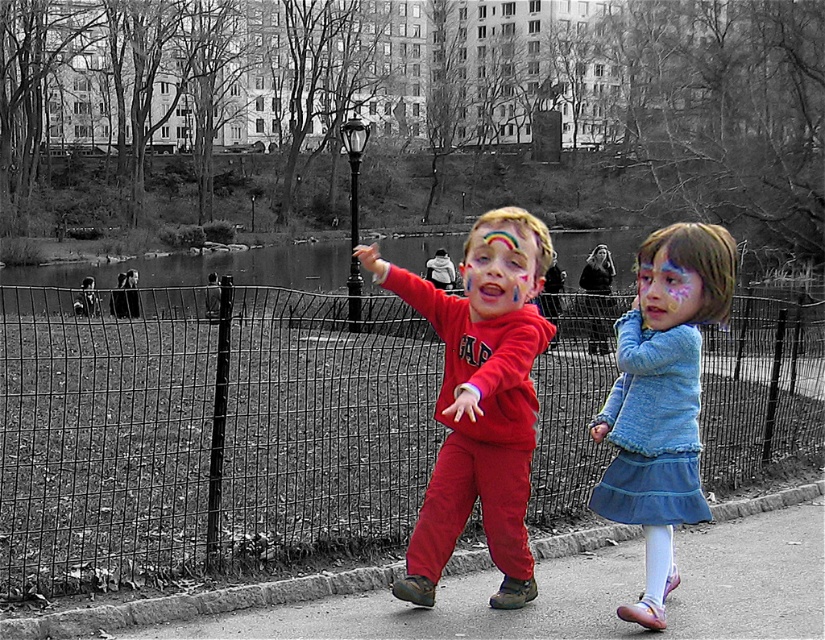
You are a drone operator trying to capture a photo of the black wire fence at center from above. What coordinates should you aim for to ensure the fence is centered in the photo?

The black wire fence at center is located at coordinates point (205, 433), so you should aim for those coordinates to center it in the photo.